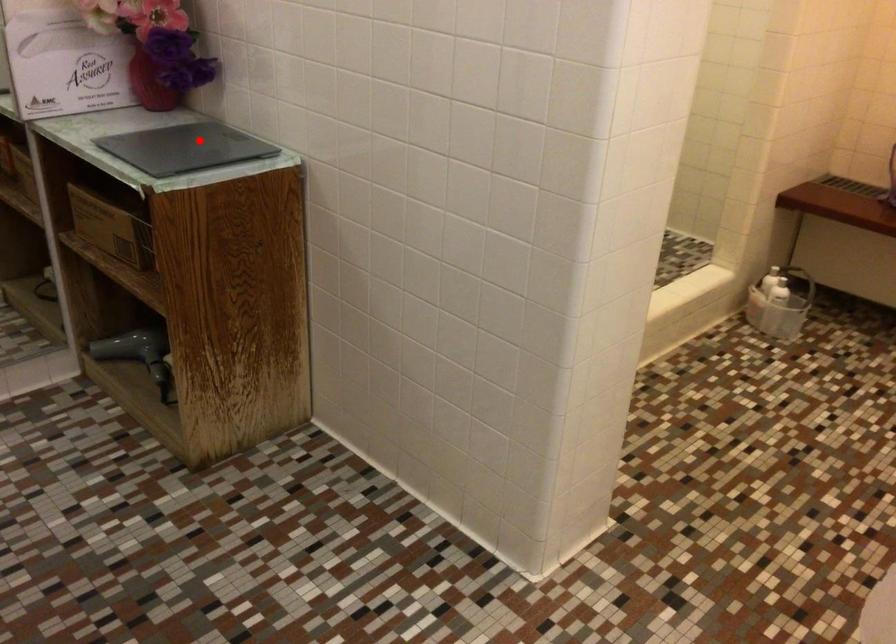
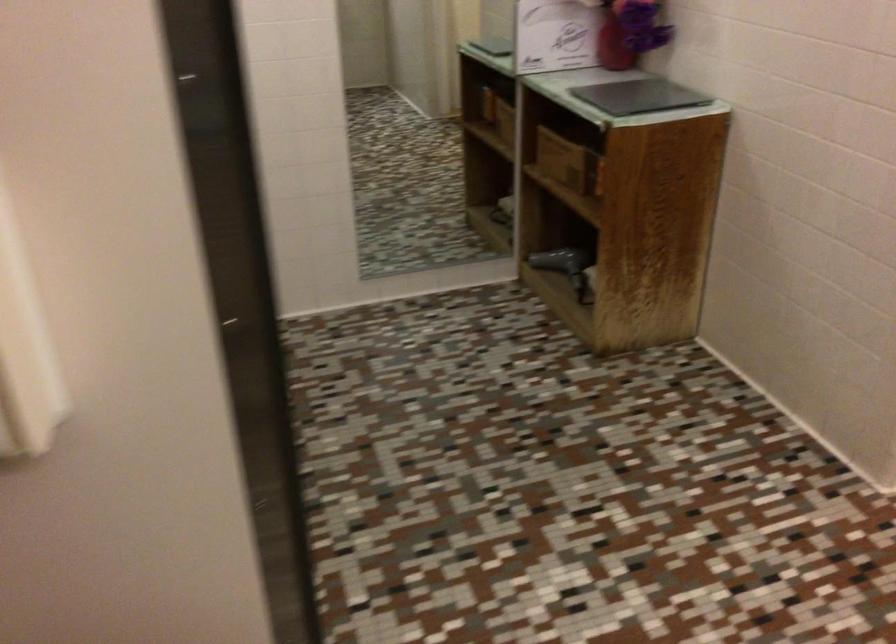
Question: I am providing you with two images of the same scene from different viewpoints. Given a red point in image1, look at the same physical point in image2. Is it:

Choices:
 (A) Closer to the viewpoint
 (B) Farther from the viewpoint

Answer: (B)